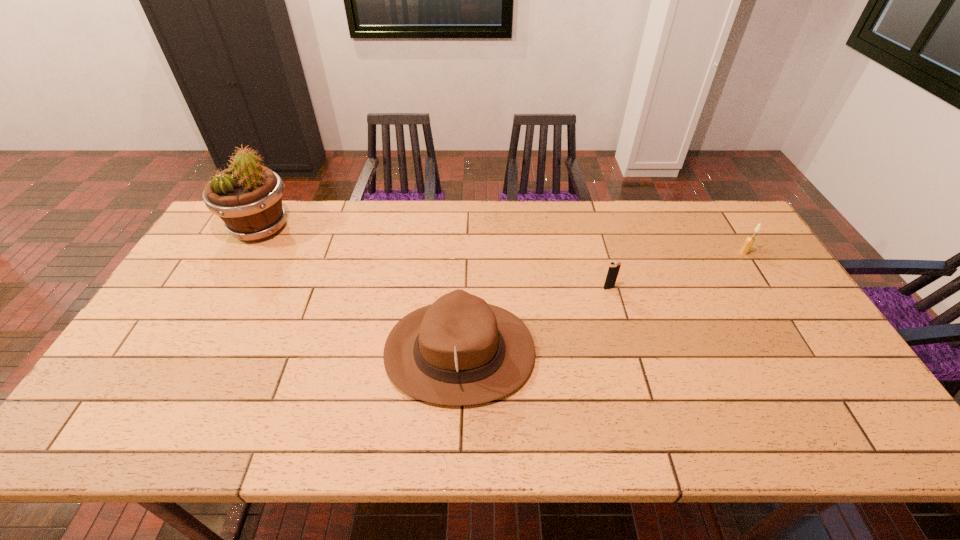
At what (x,y) coordinates should I click in order to perform the action: click on free location at the far right corner. Please return your answer as a coordinate pair (x, y). The height and width of the screenshot is (540, 960). Looking at the image, I should click on (706, 218).

Locate an element on the screen. free spot between the candle and the fedora is located at coordinates (602, 302).

I want to click on empty location between the rightmost object and the leftmost object, so click(x=502, y=240).

The image size is (960, 540). Find the location of `vacant area that lies between the nearest object and the tallest object`. vacant area that lies between the nearest object and the tallest object is located at coordinates (360, 289).

At what (x,y) coordinates should I click in order to perform the action: click on vacant area that lies between the rightmost object and the tallest object. Please return your answer as a coordinate pair (x, y). Looking at the image, I should click on (502, 240).

Where is `vacant space in between the candle and the third farthest object`? The width and height of the screenshot is (960, 540). vacant space in between the candle and the third farthest object is located at coordinates (676, 270).

This screenshot has width=960, height=540. I want to click on free space between the flowerpot and the second object from left to right, so click(360, 289).

Image resolution: width=960 pixels, height=540 pixels. I want to click on free space between the second tallest object and the igniter, so click(534, 320).

Find the location of a particular element. This screenshot has width=960, height=540. vacant point located between the second tallest object and the igniter is located at coordinates (534, 320).

This screenshot has width=960, height=540. What are the coordinates of `free space between the igniter and the flowerpot` in the screenshot? It's located at (435, 258).